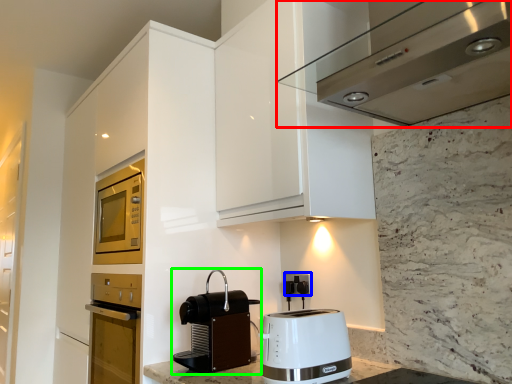
Question: Based on their relative distances, which object is farther from home appliance (highlighted by a red box)? Choose from electric outlet (highlighted by a blue box) and kitchen appliance (highlighted by a green box).

Choices:
 (A) electric outlet
 (B) kitchen appliance

Answer: (A)